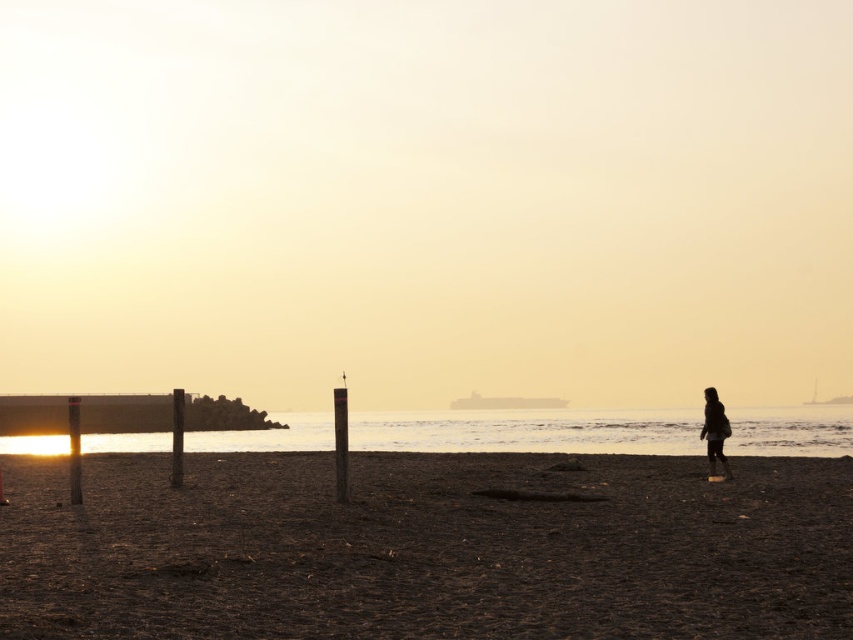
Does dark sand at lower center have a lesser width compared to dark textured coat at right?

No, dark sand at lower center is not thinner than dark textured coat at right.

Is dark sand at lower center closer to the viewer compared to dark textured coat at right?

That is True.

Is point (787, 611) positioned in front of point (717, 428)?

Yes, it is in front of point (717, 428).

The height and width of the screenshot is (640, 853). I want to click on dark sand at lower center, so click(x=426, y=547).